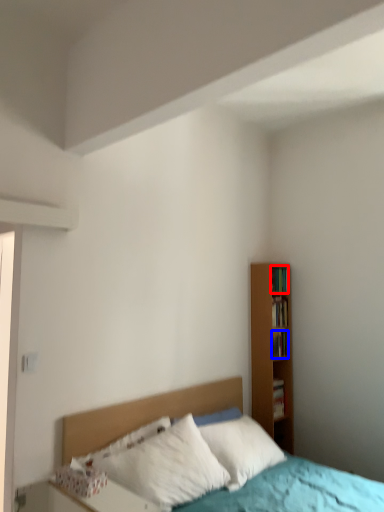
Question: Which object is further to the camera taking this photo, book (highlighted by a red box) or book (highlighted by a blue box)?

Choices:
 (A) book
 (B) book

Answer: (A)